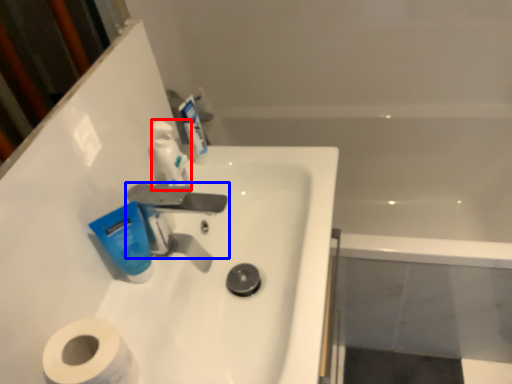
Question: Which object appears closest to the camera in this image, toiletry (highlighted by a red box) or tap (highlighted by a blue box)?

Choices:
 (A) toiletry
 (B) tap

Answer: (B)